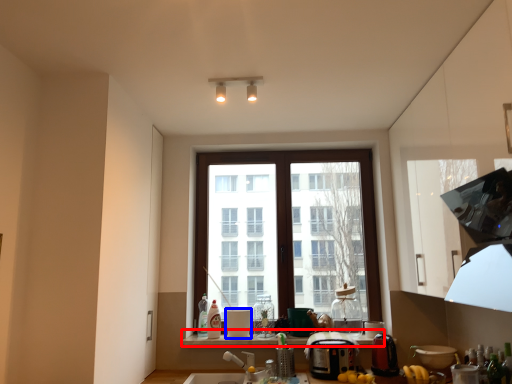
Question: Among these objects, which one is farthest to the camera, window sill (highlighted by a red box) or appliance (highlighted by a blue box)?

Choices:
 (A) window sill
 (B) appliance

Answer: (B)